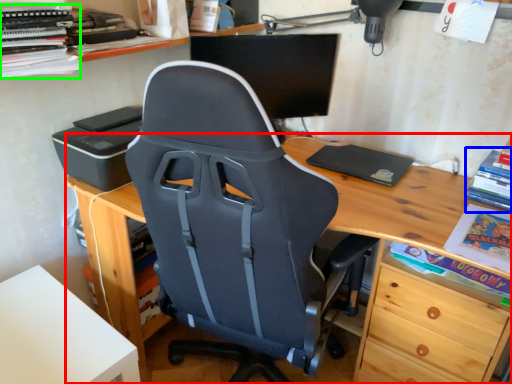
Question: Which is nearer to the desk (highlighted by a red box)? book (highlighted by a blue box) or book (highlighted by a green box).

Choices:
 (A) book
 (B) book

Answer: (A)